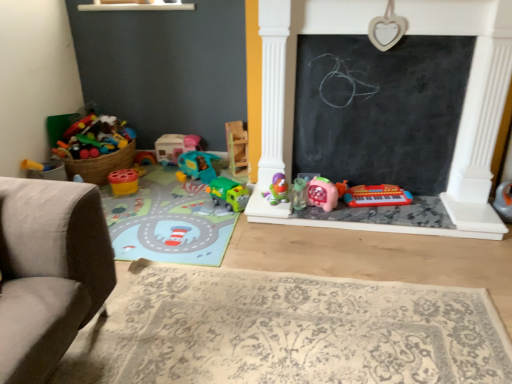
Question: Is green plastic truck at center, which ranks as the 4th toy in left-to-right order, aimed at matte plastic toy car at center, the 9th toy when ordered from right to left?

Choices:
 (A) no
 (B) yes

Answer: (A)

Question: Is green plastic truck at center, the seventh toy viewed from the right, wider than matte plastic toy car at center, the 2th toy from the left?

Choices:
 (A) no
 (B) yes

Answer: (B)

Question: Does green plastic truck at center, which ranks as the 4th toy in left-to-right order, appear on the left side of matte plastic toy car at center, the 9th toy when ordered from right to left?

Choices:
 (A) no
 (B) yes

Answer: (A)

Question: Considering the relative sizes of green plastic truck at center, which ranks as the 4th toy in left-to-right order, and matte plastic toy car at center, the 2th toy from the left, in the image provided, is green plastic truck at center, which ranks as the 4th toy in left-to-right order, thinner than matte plastic toy car at center, the 2th toy from the left,?

Choices:
 (A) no
 (B) yes

Answer: (A)

Question: Is green plastic truck at center, which ranks as the 4th toy in left-to-right order, closer to the viewer compared to matte plastic toy car at center, the 2th toy from the left?

Choices:
 (A) yes
 (B) no

Answer: (A)

Question: Is point coord(385,200) closer or farther from the camera than point coord(499,187)?

Choices:
 (A) closer
 (B) farther

Answer: (B)

Question: Considering the positions of red plastic keyboard at lower center, the ninth toy when ordered from left to right, and white plastic toy at right, marked as the 10th toy in a left-to-right arrangement, in the image, is red plastic keyboard at lower center, the ninth toy when ordered from left to right, bigger or smaller than white plastic toy at right, marked as the 10th toy in a left-to-right arrangement,?

Choices:
 (A) big
 (B) small

Answer: (A)

Question: Relative to white plastic toy at right, which is the 1th toy from right to left, is red plastic keyboard at lower center, which is the 2th toy in right-to-left order, in front or behind?

Choices:
 (A) behind
 (B) front

Answer: (A)

Question: From the image's perspective, is red plastic keyboard at lower center, which is the 2th toy in right-to-left order, above or below white plastic toy at right, marked as the 10th toy in a left-to-right arrangement?

Choices:
 (A) below
 (B) above

Answer: (B)

Question: From a real-world perspective, is clear plastic sippy cup at center, which ranks as the 7th toy in left-to-right order, positioned above or below matte plastic cup at center-left, acting as the 10th toy starting from the right?

Choices:
 (A) below
 (B) above

Answer: (B)

Question: From the image's perspective, relative to matte plastic cup at center-left, which is the first toy in left-to-right order, is clear plastic sippy cup at center, the fourth toy when ordered from right to left, above or below?

Choices:
 (A) below
 (B) above

Answer: (A)

Question: Considering the relative positions of clear plastic sippy cup at center, which ranks as the 7th toy in left-to-right order, and matte plastic cup at center-left, which is the first toy in left-to-right order, in the image provided, is clear plastic sippy cup at center, which ranks as the 7th toy in left-to-right order, to the left or to the right of matte plastic cup at center-left, which is the first toy in left-to-right order,?

Choices:
 (A) left
 (B) right

Answer: (B)

Question: Is clear plastic sippy cup at center, which ranks as the 7th toy in left-to-right order, situated inside matte plastic cup at center-left, acting as the 10th toy starting from the right, or outside?

Choices:
 (A) outside
 (B) inside

Answer: (A)

Question: Looking at their shapes, would you say teal plastic toy car at center, the eighth toy viewed from the right, is wider or thinner than red plastic keyboard at lower center, which is the 2th toy in right-to-left order?

Choices:
 (A) wide
 (B) thin

Answer: (A)

Question: From the image's perspective, relative to red plastic keyboard at lower center, the ninth toy when ordered from left to right, is teal plastic toy car at center, which appears as the 3th toy when viewed from the left, above or below?

Choices:
 (A) below
 (B) above

Answer: (B)